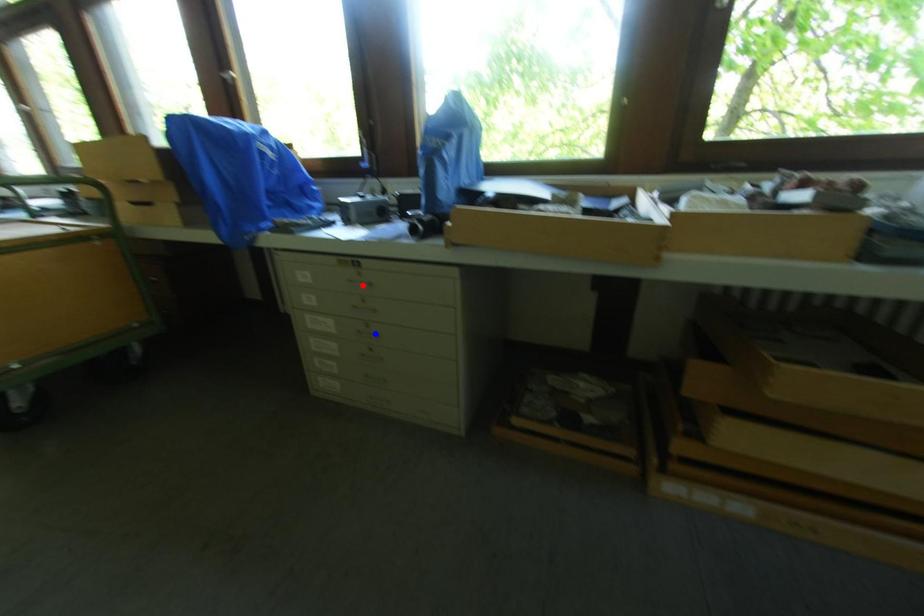
Question: Which of the two points in the image is closer to the camera?

Choices:
 (A) Blue point is closer.
 (B) Red point is closer.

Answer: (B)